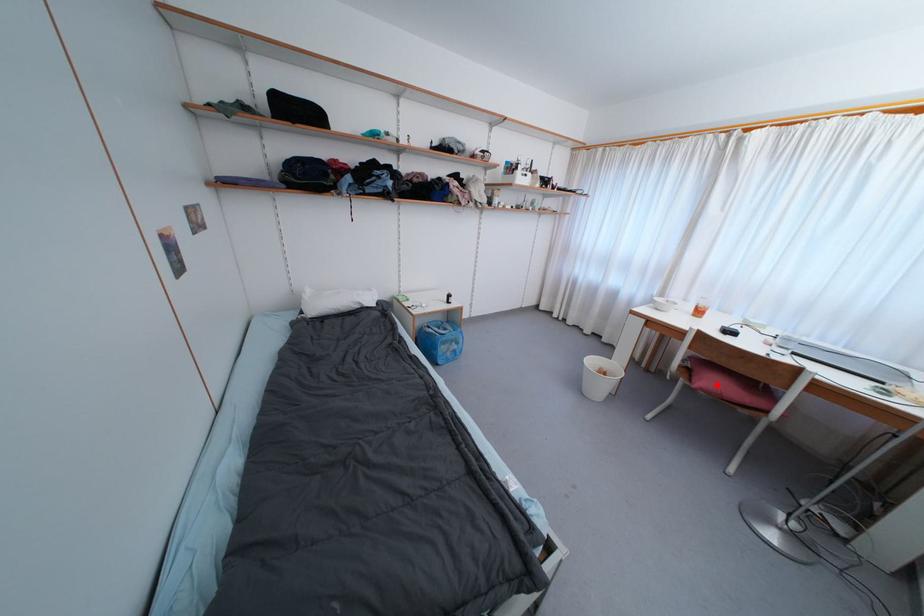
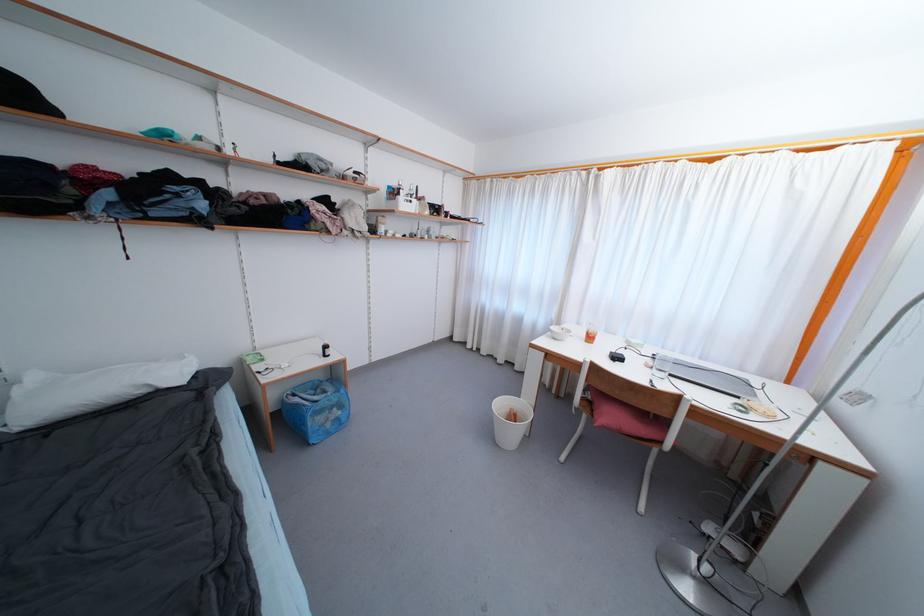
The point at the highlighted location is marked in the first image. Where is the corresponding point in the second image?

(615, 419)